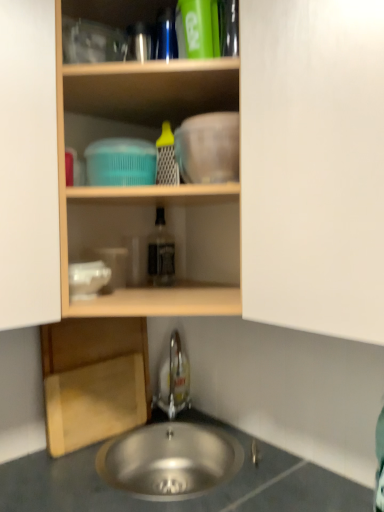
Question: Should I look upward or downward to see metallic gray sink at lower center?

Choices:
 (A) up
 (B) down

Answer: (B)

Question: Can you confirm if wooden shelf at upper center is wider than wooden cutting board at lower left?

Choices:
 (A) no
 (B) yes

Answer: (B)

Question: Is wooden shelf at upper center facing away from wooden cutting board at lower left?

Choices:
 (A) yes
 (B) no

Answer: (B)

Question: Considering the relative sizes of wooden shelf at upper center and wooden cutting board at lower left in the image provided, is wooden shelf at upper center shorter than wooden cutting board at lower left?

Choices:
 (A) yes
 (B) no

Answer: (B)

Question: Is wooden shelf at upper center to the right of wooden cutting board at lower left from the viewer's perspective?

Choices:
 (A) no
 (B) yes

Answer: (B)

Question: Can you confirm if wooden shelf at upper center is thinner than wooden cutting board at lower left?

Choices:
 (A) no
 (B) yes

Answer: (A)

Question: Does wooden shelf at upper center turn towards wooden cutting board at lower left?

Choices:
 (A) no
 (B) yes

Answer: (A)

Question: Is wooden shelf at upper center further to camera compared to satin nickel faucet at lower center?

Choices:
 (A) yes
 (B) no

Answer: (B)

Question: Is wooden shelf at upper center with satin nickel faucet at lower center?

Choices:
 (A) no
 (B) yes

Answer: (A)

Question: From the image's perspective, would you say wooden shelf at upper center is positioned over satin nickel faucet at lower center?

Choices:
 (A) yes
 (B) no

Answer: (A)

Question: Is wooden shelf at upper center taller than satin nickel faucet at lower center?

Choices:
 (A) yes
 (B) no

Answer: (A)

Question: Considering the relative sizes of wooden shelf at upper center and satin nickel faucet at lower center in the image provided, is wooden shelf at upper center smaller than satin nickel faucet at lower center?

Choices:
 (A) yes
 (B) no

Answer: (B)

Question: Considering the relative sizes of wooden shelf at upper center and satin nickel faucet at lower center in the image provided, is wooden shelf at upper center thinner than satin nickel faucet at lower center?

Choices:
 (A) yes
 (B) no

Answer: (B)

Question: Can you confirm if wooden shelf at upper center is positioned to the right of white matte cabinet at center?

Choices:
 (A) no
 (B) yes

Answer: (A)